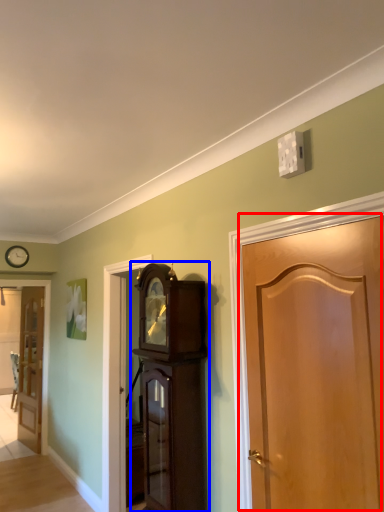
Question: Which object appears farthest to the camera in this image, door (highlighted by a red box) or cabinetry (highlighted by a blue box)?

Choices:
 (A) door
 (B) cabinetry

Answer: (B)